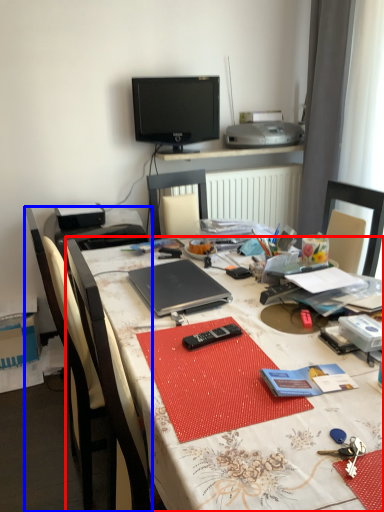
Question: Which point is further to the camera, desk (highlighted by a red box) or chair (highlighted by a blue box)?

Choices:
 (A) desk
 (B) chair

Answer: (B)